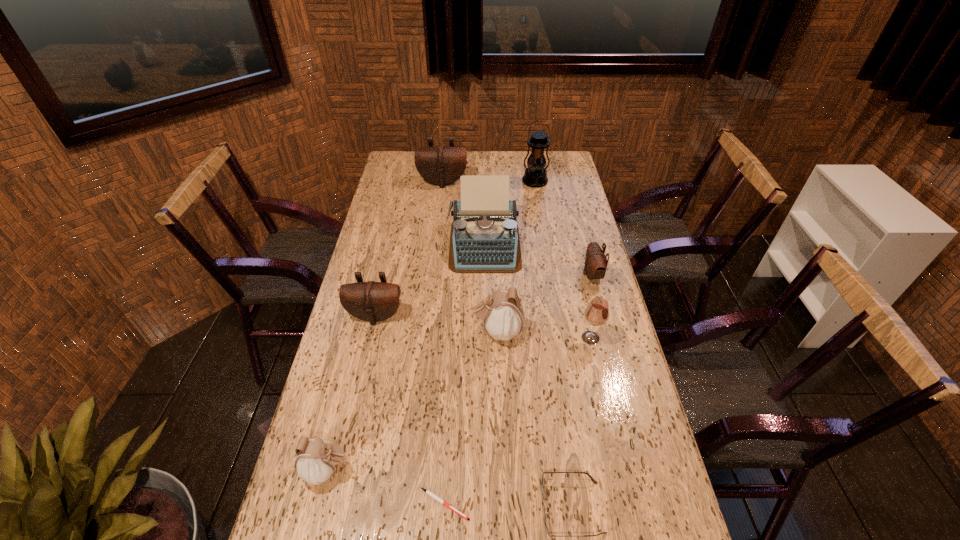
Identify the location of vacant space located 0.330m on the front-facing side of the fourth pouch from left to right. (366, 332).

Image resolution: width=960 pixels, height=540 pixels. I want to click on free region located with the flap open on the second biggest brown pouch, so click(369, 347).

You are a GUI agent. You are given a task and a screenshot of the screen. Output one action in this format:
    pyautogui.click(x=<x>, y=<y>)
    Task: Click on the vacant space situated 0.050m on the front of the wineglass
    The width and height of the screenshot is (960, 540).
    Given the screenshot: What is the action you would take?
    pyautogui.click(x=595, y=361)

Where is `vacant space located 0.230m on the front-facing side of the nearer white pouch`? vacant space located 0.230m on the front-facing side of the nearer white pouch is located at coordinates (447, 470).

In order to click on free location located with the flap open on the second farthest brown pouch in this screenshot , I will do `click(484, 274)`.

This screenshot has height=540, width=960. What are the coordinates of `vacant space located with the flap open on the second farthest brown pouch` in the screenshot? It's located at (487, 274).

At what (x,y) coordinates should I click in order to perform the action: click on free location located with the flap open on the second farthest brown pouch. Please return your answer as a coordinate pair (x, y). This screenshot has height=540, width=960. Looking at the image, I should click on (543, 274).

This screenshot has height=540, width=960. I want to click on vacant space located 0.220m on the clicker of the white pen, so click(x=565, y=504).

Identify the location of lantern located in the far edge section of the desktop. Image resolution: width=960 pixels, height=540 pixels. (535, 175).

Locate an element on the screen. This screenshot has width=960, height=540. pouch at the far edge is located at coordinates (440, 165).